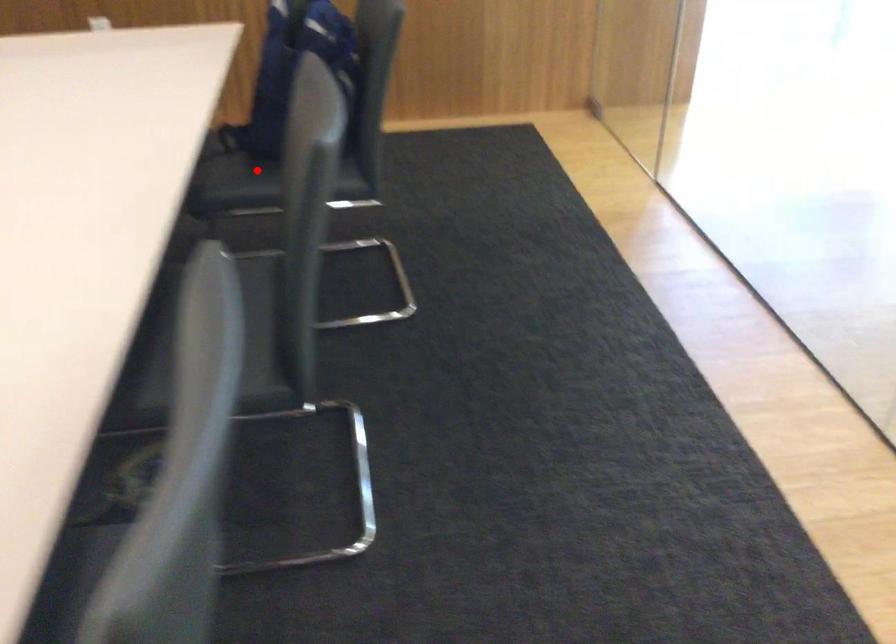
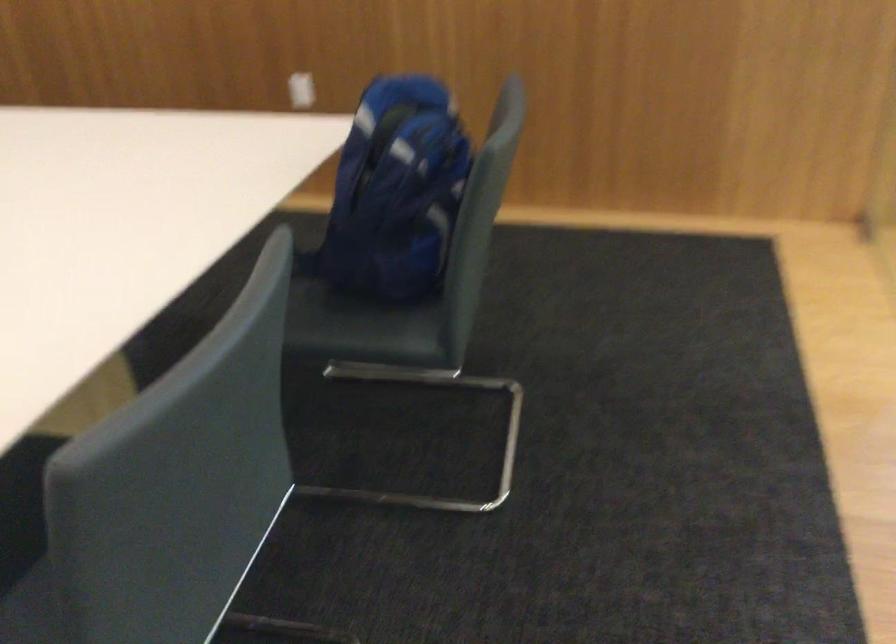
Question: I am providing you with two images of the same scene from different viewpoints. Given a red point in image1, look at the same physical point in image2. Is it:

Choices:
 (A) Closer to the viewpoint
 (B) Farther from the viewpoint

Answer: (A)